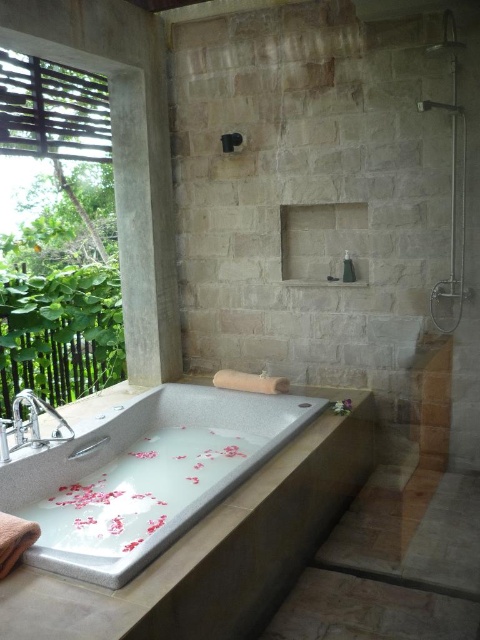
You are designing a layout for a spa bathroom and need to place a new shelf between the white marble bathtub at center and the matte gray showerhead at upper right. Based on their sizes, which object should the shelf be closer to?

The white marble bathtub at center is larger in size than the matte gray showerhead at upper right, so the shelf should be placed closer to the smaller matte gray showerhead at upper right to maintain balance in the layout.

You are a guest at this spa and need to wash your hands before entering the tub. Which object should you use, the silver metallic sink at left or the matte gray showerhead at upper right?

The silver metallic sink at left is taller than the matte gray showerhead at upper right, so you should use the silver metallic sink at left to wash your hands.